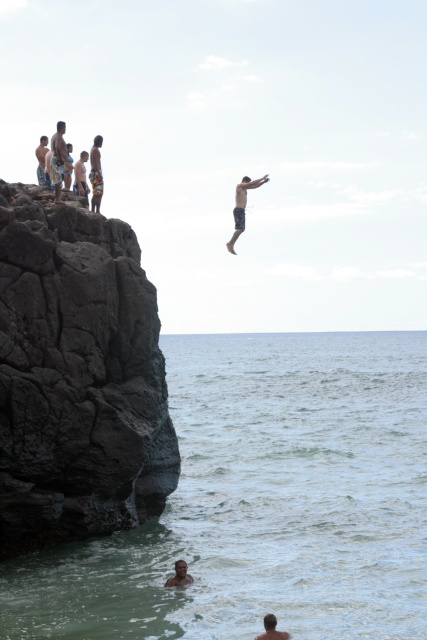
You are a photographer taking a photo of the cliffside scene. You notice two men wearing skinny black shorts at center and camouflage shorts at upper left. Which man is positioned lower in the image?

The man wearing skinny black shorts at center is positioned lower in the image because he has a lesser height compared to the camouflage shorts at upper left.

You are a photographer positioned at the bottom of the cliff, looking up at the cliffside. You want to take a photo of the skinny black shorts at center. Based on their 2D location coordinates, where should you aim your camera?

The skinny black shorts at center are located at point 2D coordinates of 0.323 on the horizontal axis and 0.567 on the vertical axis, so you should aim your camera slightly to the right of center and a bit above the midpoint of the cliff.